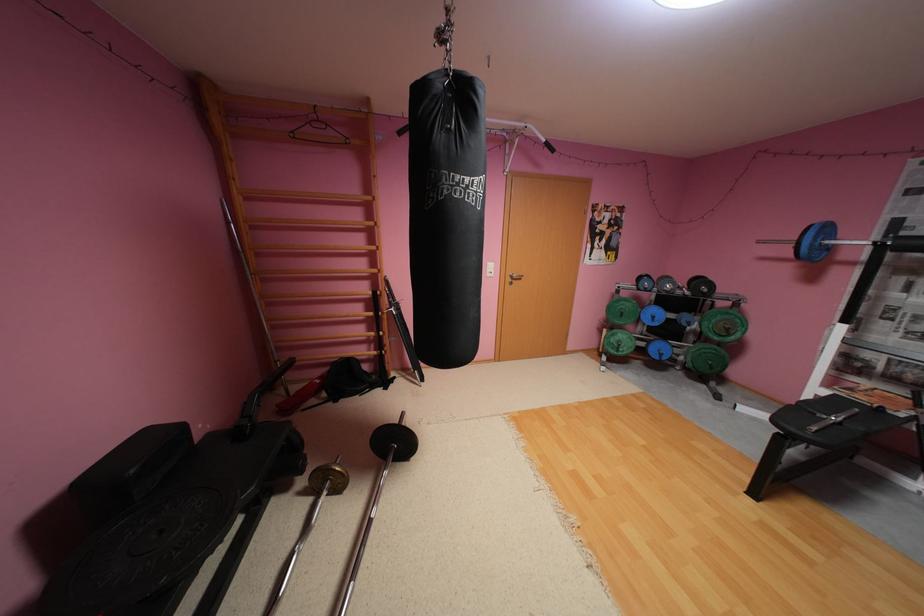
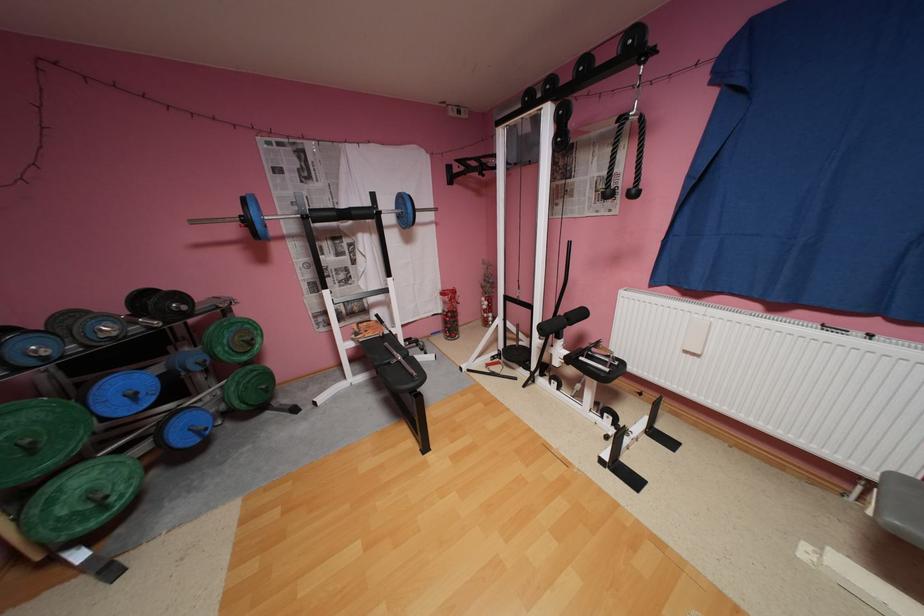
Locate, in the second image, the point that corresponds to (626,351) in the first image.

(116, 508)